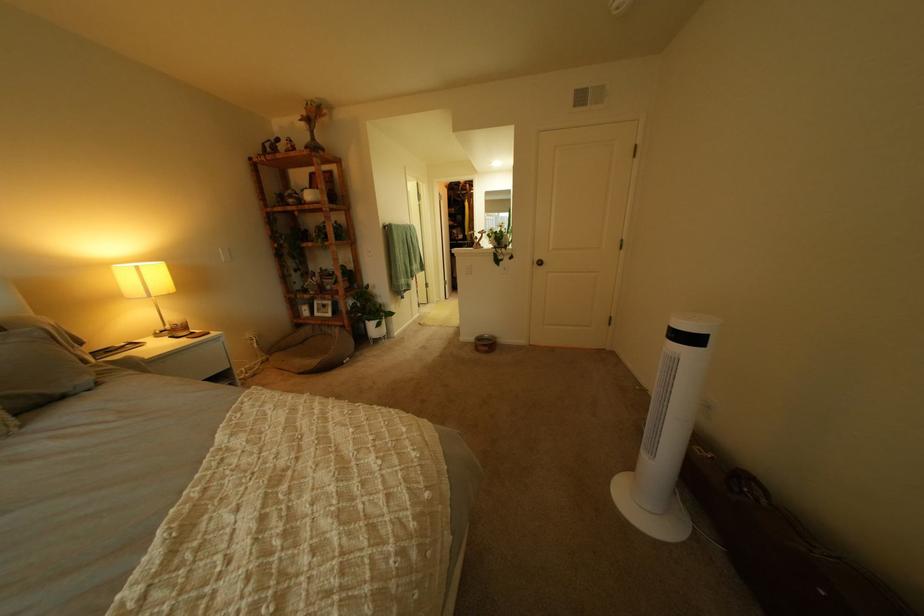
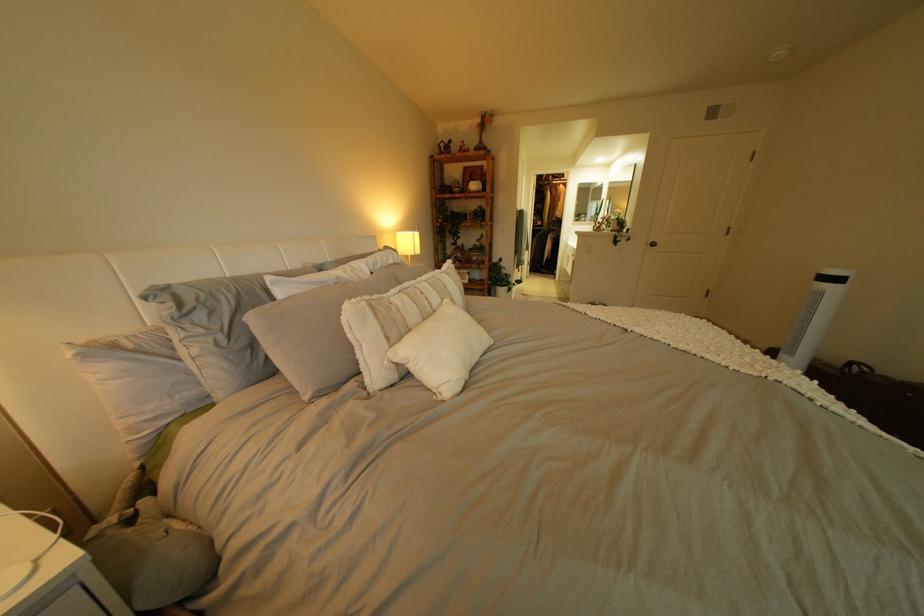
In a continuous first-person perspective shot, in which direction is the camera moving?

The movement direction of the cameraman is left, backward.